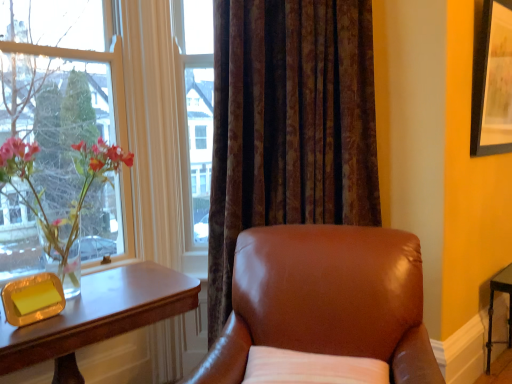
Question: Is translucent glass vase at left far from wooden table at left?

Choices:
 (A) yes
 (B) no

Answer: (B)

Question: Is translucent glass vase at left looking in the opposite direction of wooden table at left?

Choices:
 (A) no
 (B) yes

Answer: (A)

Question: From a real-world perspective, is translucent glass vase at left under wooden table at left?

Choices:
 (A) yes
 (B) no

Answer: (B)

Question: Can you confirm if translucent glass vase at left is smaller than wooden table at left?

Choices:
 (A) no
 (B) yes

Answer: (B)

Question: Does translucent glass vase at left appear on the right side of wooden table at left?

Choices:
 (A) no
 (B) yes

Answer: (A)

Question: Visually, is white fabric pillow at lower center positioned to the left or to the right of wooden table at left?

Choices:
 (A) right
 (B) left

Answer: (A)

Question: Do you think white fabric pillow at lower center is within wooden table at left, or outside of it?

Choices:
 (A) outside
 (B) inside

Answer: (A)

Question: Considering the positions of white fabric pillow at lower center and wooden table at left in the image, is white fabric pillow at lower center taller or shorter than wooden table at left?

Choices:
 (A) tall
 (B) short

Answer: (B)

Question: From a real-world perspective, relative to wooden table at left, is white fabric pillow at lower center vertically above or below?

Choices:
 (A) above
 (B) below

Answer: (A)

Question: From a real-world perspective, is wooden table at left physically located above or below clear glass vase at left?

Choices:
 (A) above
 (B) below

Answer: (B)

Question: From the image's perspective, relative to clear glass vase at left, is wooden table at left above or below?

Choices:
 (A) above
 (B) below

Answer: (B)

Question: Is wooden table at left wider or thinner than clear glass vase at left?

Choices:
 (A) thin
 (B) wide

Answer: (B)

Question: Choose the correct answer: Is wooden table at left inside clear glass vase at left or outside it?

Choices:
 (A) inside
 (B) outside

Answer: (B)

Question: Is point (19, 140) positioned closer to the camera than point (105, 105)?

Choices:
 (A) closer
 (B) farther

Answer: (A)

Question: From a real-world perspective, is translucent glass vase at left positioned above or below clear glass vase at left?

Choices:
 (A) below
 (B) above

Answer: (A)